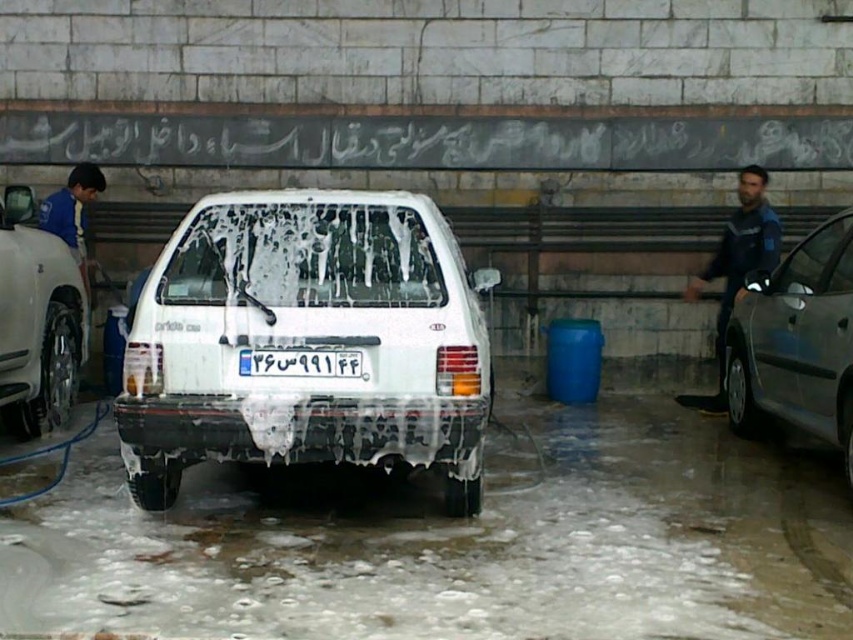
Question: Which point appears farthest from the camera in this image?

Choices:
 (A) (0, 333)
 (B) (148, 452)
 (C) (84, 163)
 (D) (838, 300)

Answer: (C)

Question: Is white matte car at center to the left of blue fabric shirt at left from the viewer's perspective?

Choices:
 (A) yes
 (B) no

Answer: (B)

Question: Does white matte car at left have a greater width compared to white plastic license plate at center?

Choices:
 (A) no
 (B) yes

Answer: (A)

Question: Estimate the real-world distances between objects in this image. Which object is closer to the blue denim jeans at right?

Choices:
 (A) white plastic license plate at center
 (B) silver metallic sedan at right
 (C) white matte car at left
 (D) white matte car at center

Answer: (B)

Question: In this image, where is white matte car at center located relative to silver metallic sedan at right?

Choices:
 (A) below
 (B) above

Answer: (B)

Question: Which point is closer to the camera?

Choices:
 (A) (730, 301)
 (B) (239, 369)
 (C) (831, 264)
 (D) (340, 385)

Answer: (B)